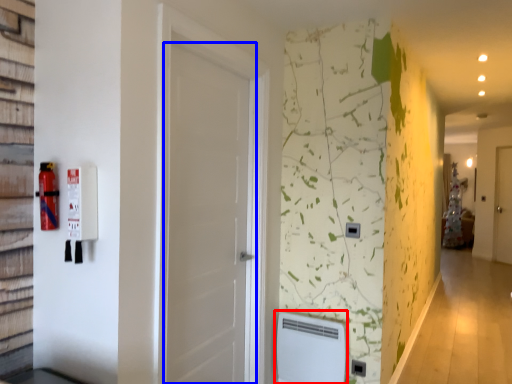
Question: Which of the following is the closest to the observer, water heater (highlighted by a red box) or door (highlighted by a blue box)?

Choices:
 (A) water heater
 (B) door

Answer: (B)